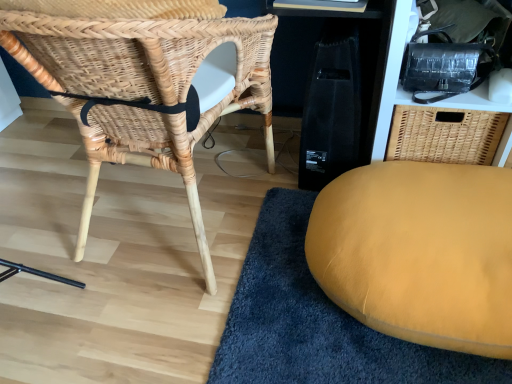
Question: Is mustard yellow cushion at lower right not inside black textured bag at upper right?

Choices:
 (A) yes
 (B) no

Answer: (A)

Question: Can you confirm if mustard yellow cushion at lower right is shorter than black textured bag at upper right?

Choices:
 (A) yes
 (B) no

Answer: (A)

Question: Would you say black textured bag at upper right is part of mustard yellow cushion at lower right's contents?

Choices:
 (A) yes
 (B) no

Answer: (B)

Question: Does mustard yellow cushion at lower right have a lesser width compared to black textured bag at upper right?

Choices:
 (A) yes
 (B) no

Answer: (B)

Question: Is mustard yellow cushion at lower right positioned in front of black textured bag at upper right?

Choices:
 (A) yes
 (B) no

Answer: (A)

Question: Is black textured bag at upper right taller or shorter than natural woven chair at left?

Choices:
 (A) tall
 (B) short

Answer: (B)

Question: Is point (397, 86) closer or farther from the camera than point (196, 24)?

Choices:
 (A) farther
 (B) closer

Answer: (A)

Question: From a real-world perspective, is black textured bag at upper right positioned above or below natural woven chair at left?

Choices:
 (A) below
 (B) above

Answer: (A)

Question: Is black textured bag at upper right in front of or behind natural woven chair at left in the image?

Choices:
 (A) front
 (B) behind

Answer: (B)

Question: Considering the relative positions of mustard yellow cushion at lower right and black textured bag at upper right in the image provided, is mustard yellow cushion at lower right to the left or to the right of black textured bag at upper right?

Choices:
 (A) right
 (B) left

Answer: (B)

Question: Does point (481, 276) appear closer or farther from the camera than point (392, 92)?

Choices:
 (A) closer
 (B) farther

Answer: (A)

Question: From a real-world perspective, relative to black textured bag at upper right, is mustard yellow cushion at lower right vertically above or below?

Choices:
 (A) above
 (B) below

Answer: (B)

Question: In terms of height, does mustard yellow cushion at lower right look taller or shorter compared to black textured bag at upper right?

Choices:
 (A) tall
 (B) short

Answer: (B)

Question: From a real-world perspective, is mustard yellow cushion at lower right positioned above or below natural woven chair at left?

Choices:
 (A) above
 (B) below

Answer: (B)

Question: In the image, is mustard yellow cushion at lower right positioned in front of or behind natural woven chair at left?

Choices:
 (A) front
 (B) behind

Answer: (B)